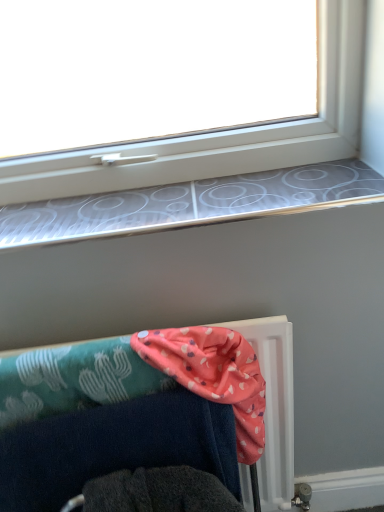
Question: Is pink fabric at lower right to the left or to the right of pink fabric at lower center in the image?

Choices:
 (A) right
 (B) left

Answer: (B)

Question: Is pink fabric at lower right inside or outside of pink fabric at lower center?

Choices:
 (A) inside
 (B) outside

Answer: (B)

Question: Considering the real-world distances, which object is closest to the silver metallic window sill at upper center?

Choices:
 (A) pink fabric at lower center
 (B) pink fabric at lower right

Answer: (A)

Question: Which object is the farthest from the silver metallic window sill at upper center?

Choices:
 (A) pink fabric at lower center
 (B) pink fabric at lower right

Answer: (B)